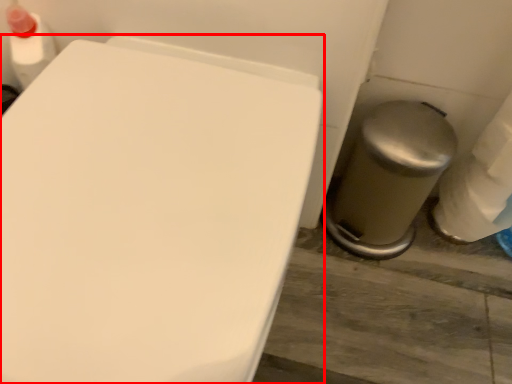
Question: From the image's perspective, where is toilet (annotated by the red box) located relative to porcelain?

Choices:
 (A) above
 (B) below

Answer: (B)